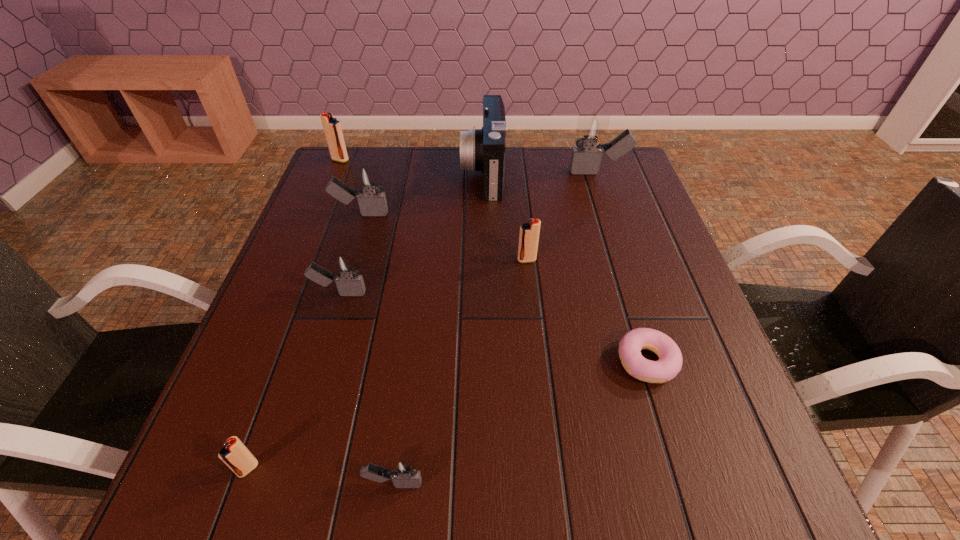
Locate an element on the screen. This screenshot has width=960, height=540. vacant space at the far right corner of the desktop is located at coordinates pos(629,188).

Locate an element on the screen. free spot between the sixth igniter from left to right and the smallest red igniter is located at coordinates (388, 364).

Locate an element on the screen. vacant space that's between the second nearest red igniter and the smallest red igniter is located at coordinates (388, 364).

Locate an element on the screen. This screenshot has height=540, width=960. free space between the sixth nearest igniter and the nearest red igniter is located at coordinates (423, 321).

The image size is (960, 540). I want to click on vacant area that lies between the fifth nearest igniter and the second smallest gray igniter, so click(x=350, y=254).

Where is `blank region between the fourth object from right to left and the second biggest red igniter`? The width and height of the screenshot is (960, 540). blank region between the fourth object from right to left and the second biggest red igniter is located at coordinates (505, 216).

Find the location of a particular element. unoccupied area between the second red igniter from left to right and the farthest gray igniter is located at coordinates (423, 321).

The image size is (960, 540). I want to click on vacant point located between the second nearest gray igniter and the farthest igniter, so click(340, 227).

Find the location of `vacant point located between the pink doughnut and the farthest igniter`. vacant point located between the pink doughnut and the farthest igniter is located at coordinates (493, 261).

At what (x,y) coordinates should I click in order to perform the action: click on free space between the sixth object from left to right and the sixth farthest object. Please return your answer as a coordinate pair (x, y). Image resolution: width=960 pixels, height=540 pixels. Looking at the image, I should click on (411, 233).